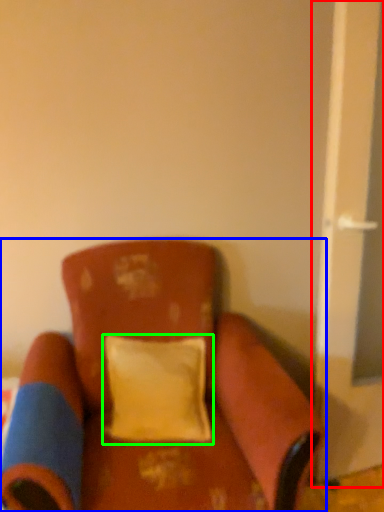
Question: Considering the real-world distances, which object is closest to screen door (highlighted by a red box)? chair (highlighted by a blue box) or pillow (highlighted by a green box).

Choices:
 (A) chair
 (B) pillow

Answer: (B)